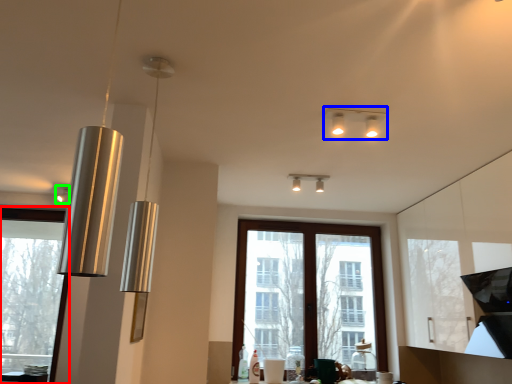
Question: Considering the real-world distances, which object is closest to window (highlighted by a red box)? lamp (highlighted by a blue box) or lamp (highlighted by a green box).

Choices:
 (A) lamp
 (B) lamp

Answer: (B)